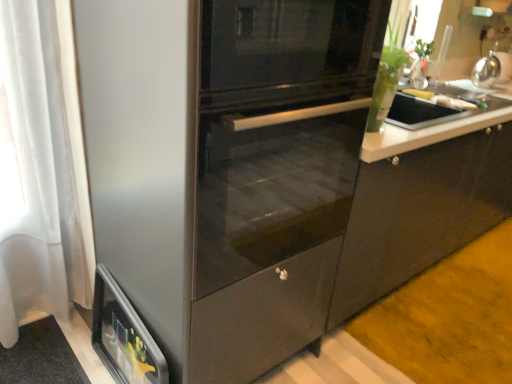
What are the coordinates of `free point to the left of satin silver kettle at upper right` in the screenshot? It's located at (454, 87).